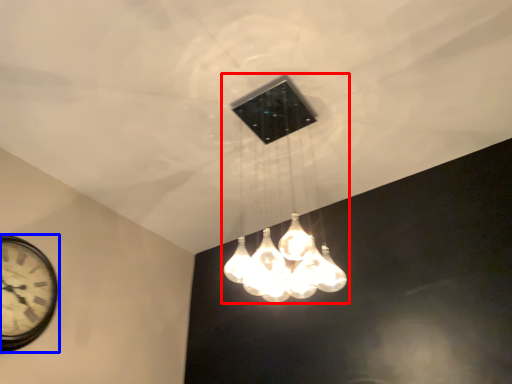
Question: Which object is closer to the camera taking this photo, lamp (highlighted by a red box) or wall clock (highlighted by a blue box)?

Choices:
 (A) lamp
 (B) wall clock

Answer: (A)